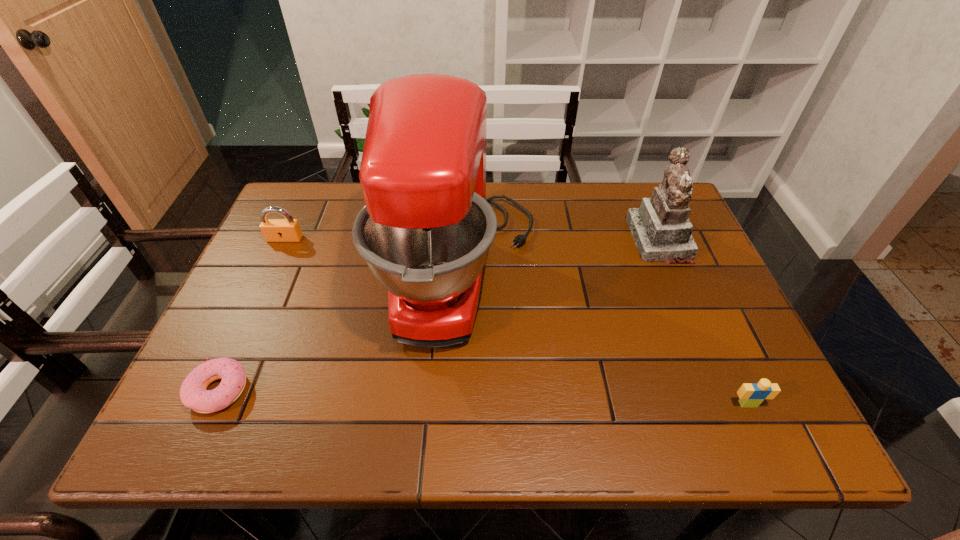
The width and height of the screenshot is (960, 540). What are the coordinates of `vacant space that's between the second tallest object and the second shortest object` in the screenshot? It's located at click(704, 322).

What are the coordinates of `free space between the fourth shortest object and the kitchen mixer` in the screenshot? It's located at (561, 255).

At what (x,y) coordinates should I click in order to perform the action: click on free spot between the tallest object and the Lego. Please return your answer as a coordinate pair (x, y). Looking at the image, I should click on (605, 338).

Where is `vacant space that's between the padlock and the fourth tallest object`? Image resolution: width=960 pixels, height=540 pixels. vacant space that's between the padlock and the fourth tallest object is located at coordinates (516, 321).

Where is `vacant space that's between the third object from right to left and the shortest object`? This screenshot has height=540, width=960. vacant space that's between the third object from right to left and the shortest object is located at coordinates (341, 330).

At what (x,y) coordinates should I click in order to perform the action: click on vacant area that lies between the padlock and the Lego. Please return your answer as a coordinate pair (x, y). Looking at the image, I should click on (516, 321).

Where is `free spot between the Lego and the tallest object`? This screenshot has height=540, width=960. free spot between the Lego and the tallest object is located at coordinates (605, 338).

Image resolution: width=960 pixels, height=540 pixels. What are the coordinates of `vacant space in between the figurine and the kitchen mixer` in the screenshot? It's located at (561, 255).

Locate which object ranks second in proximity to the third object from left to right. Please provide its 2D coordinates. Your answer should be formatted as a tuple, i.e. [(x, y)], where the tuple contains the x and y coordinates of a point satisfying the conditions above.

[(274, 230)]

Point out which object is positioned as the third nearest to the padlock. Please provide its 2D coordinates. Your answer should be formatted as a tuple, i.e. [(x, y)], where the tuple contains the x and y coordinates of a point satisfying the conditions above.

[(661, 229)]